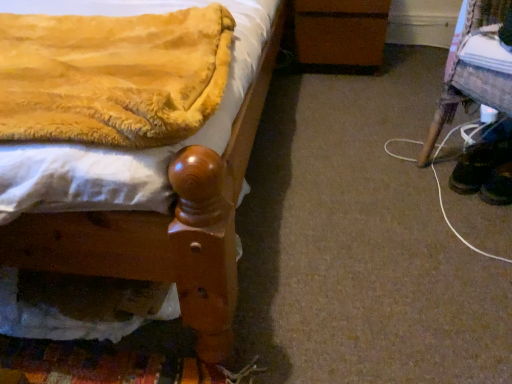
Question: Could you tell me if wooden stool at lower right is turned towards brown wooden changing table at center?

Choices:
 (A) no
 (B) yes

Answer: (A)

Question: Considering the relative positions of wooden stool at lower right and brown wooden changing table at center in the image provided, is wooden stool at lower right in front of brown wooden changing table at center?

Choices:
 (A) yes
 (B) no

Answer: (A)

Question: Does wooden stool at lower right appear on the right side of brown wooden changing table at center?

Choices:
 (A) no
 (B) yes

Answer: (B)

Question: Is wooden stool at lower right wider than brown wooden changing table at center?

Choices:
 (A) no
 (B) yes

Answer: (A)

Question: From a real-world perspective, is wooden stool at lower right on brown wooden changing table at center?

Choices:
 (A) no
 (B) yes

Answer: (B)

Question: Is velvet yellow blanket at upper left wider or thinner than black suede shoes at lower right, the first footwear when ordered from right to left?

Choices:
 (A) wide
 (B) thin

Answer: (A)

Question: From the image's perspective, is velvet yellow blanket at upper left above or below black suede shoes at lower right, the first footwear when ordered from right to left?

Choices:
 (A) above
 (B) below

Answer: (A)

Question: Is velvet yellow blanket at upper left bigger or smaller than black suede shoes at lower right, the first footwear when ordered from right to left?

Choices:
 (A) big
 (B) small

Answer: (A)

Question: Is point (68, 38) closer or farther from the camera than point (509, 198)?

Choices:
 (A) closer
 (B) farther

Answer: (A)

Question: Relative to black leather shoes at lower right, which ranks as the first footwear in left-to-right order, is velvet yellow blanket at upper left in front or behind?

Choices:
 (A) behind
 (B) front

Answer: (B)

Question: Considering the relative positions of velvet yellow blanket at upper left and black leather shoes at lower right, acting as the 2th footwear starting from the right, in the image provided, is velvet yellow blanket at upper left to the left or to the right of black leather shoes at lower right, acting as the 2th footwear starting from the right,?

Choices:
 (A) right
 (B) left

Answer: (B)

Question: Does point (84, 112) appear closer or farther from the camera than point (502, 147)?

Choices:
 (A) closer
 (B) farther

Answer: (A)

Question: Looking at their shapes, would you say velvet yellow blanket at upper left is wider or thinner than black leather shoes at lower right, which ranks as the first footwear in left-to-right order?

Choices:
 (A) thin
 (B) wide

Answer: (B)

Question: Considering the positions of black suede shoes at lower right, which is the 2th footwear in left-to-right order, and brown wooden changing table at center in the image, is black suede shoes at lower right, which is the 2th footwear in left-to-right order, bigger or smaller than brown wooden changing table at center?

Choices:
 (A) big
 (B) small

Answer: (B)

Question: Is black suede shoes at lower right, the first footwear when ordered from right to left, taller or shorter than brown wooden changing table at center?

Choices:
 (A) short
 (B) tall

Answer: (A)